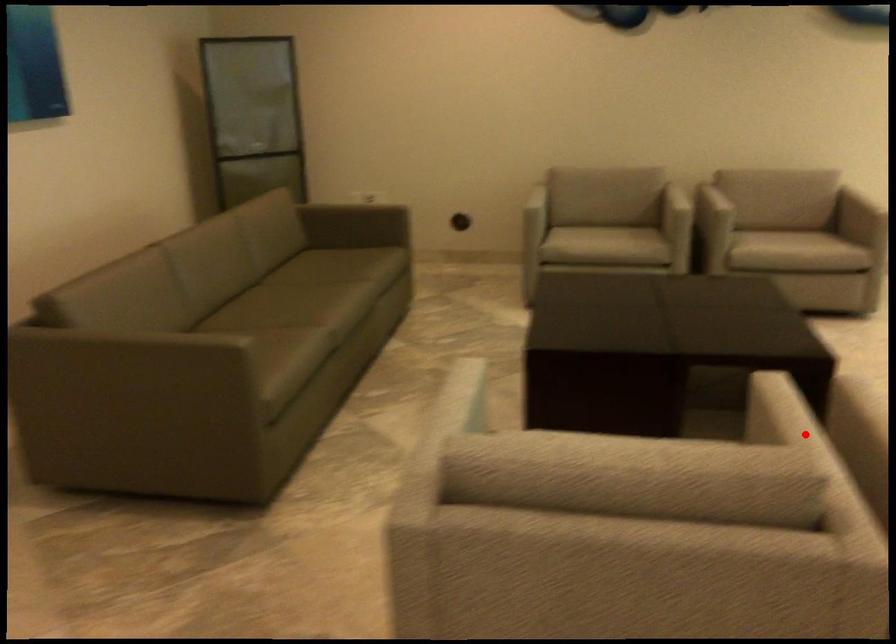
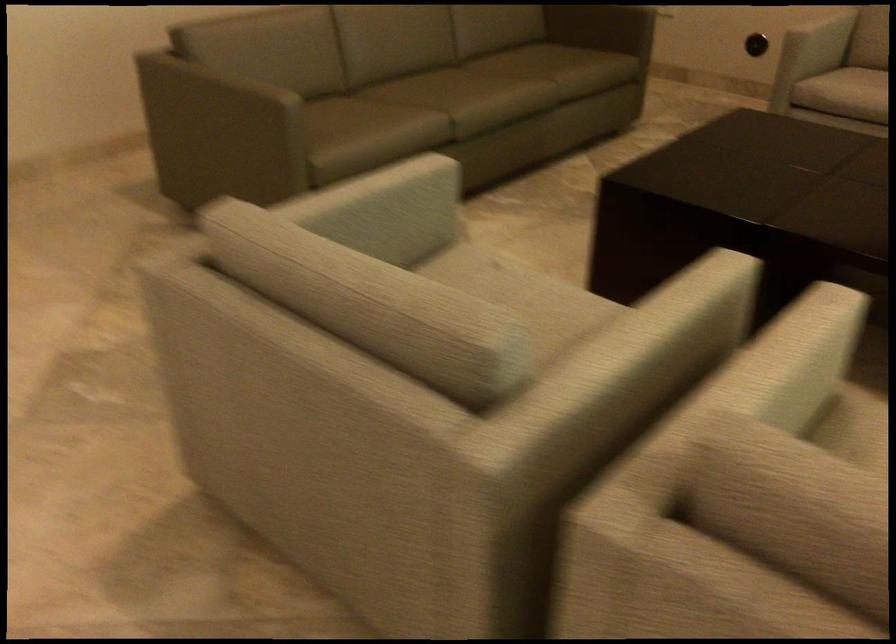
In the second image, find the point that corresponds to the highlighted location in the first image.

(659, 332)